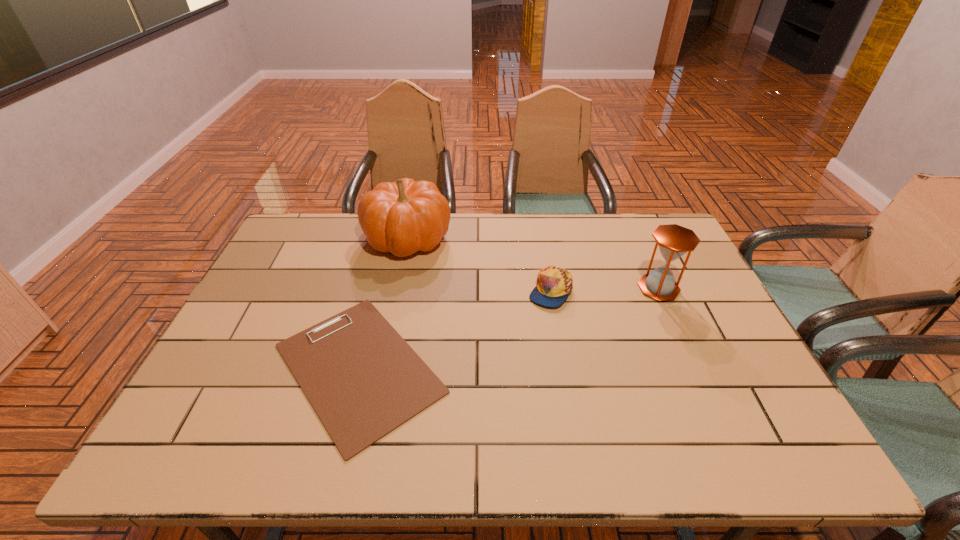
Where is `object situated at the far edge`? object situated at the far edge is located at coordinates (406, 216).

Find the location of a particular element. The width and height of the screenshot is (960, 540). object at the near edge is located at coordinates (363, 380).

Where is `object that is at the left edge`? object that is at the left edge is located at coordinates (363, 380).

You are a GUI agent. You are given a task and a screenshot of the screen. Output one action in this format:
    pyautogui.click(x=<x>, y=<y>)
    Task: Click on the object that is at the right edge
    Image resolution: width=960 pixels, height=540 pixels.
    Given the screenshot: What is the action you would take?
    pyautogui.click(x=674, y=241)

This screenshot has height=540, width=960. In order to click on object present at the near left corner in this screenshot , I will do `click(363, 380)`.

This screenshot has height=540, width=960. In the image, there is a desktop. In order to click on blank space at the far edge in this screenshot , I will do `click(490, 226)`.

Locate an element on the screen. Image resolution: width=960 pixels, height=540 pixels. vacant space at the near edge of the desktop is located at coordinates (721, 448).

The height and width of the screenshot is (540, 960). In order to click on free space at the left edge of the desktop in this screenshot , I will do `click(219, 353)`.

In the image, there is a desktop. In order to click on free space at the right edge in this screenshot , I will do `click(688, 278)`.

In the image, there is a desktop. Identify the location of vacant space at the near right corner. (755, 437).